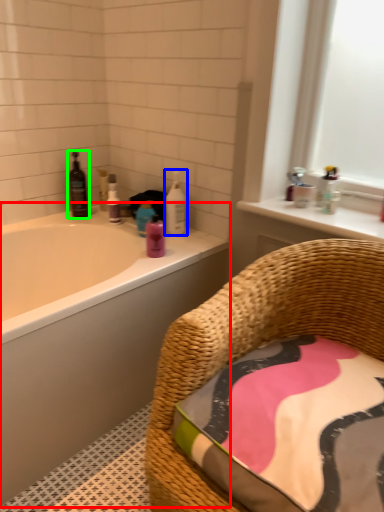
Question: Estimate the real-world distances between objects in this image. Which object is closer to bathtub (highlighted by a red box), cleaning product (highlighted by a blue box) or wine bottle (highlighted by a green box)?

Choices:
 (A) cleaning product
 (B) wine bottle

Answer: (A)